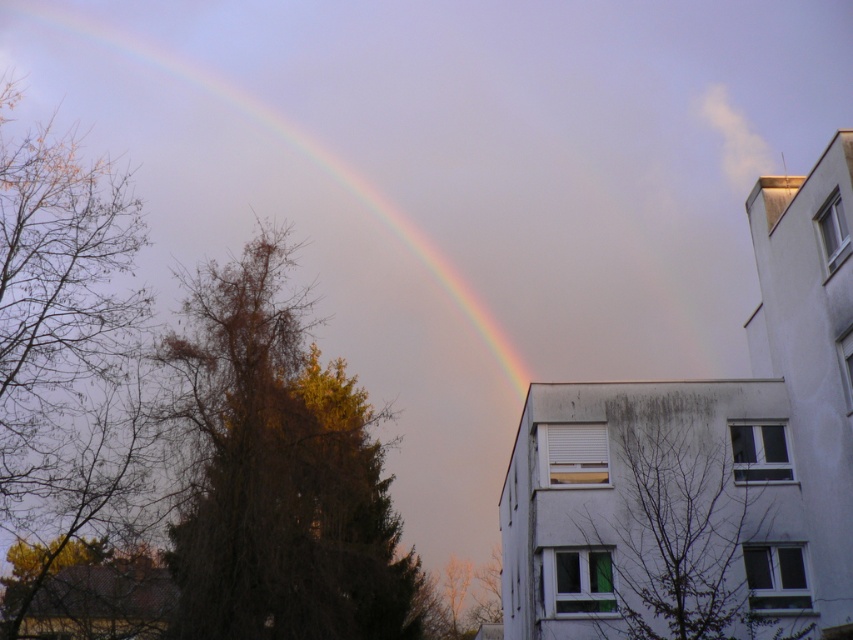
You are standing in the urban scene and want to take a photo of both the point at coordinates point (392, 176) and the point at coordinates point (55, 378). Which point will appear closer to the bottom of your camera viewfinder?

Point (55, 378) will appear closer to the bottom of the camera viewfinder because it is closer to the camera compared to point (392, 176), which is further away.

You are standing in the urban scene and want to take a photo of both the point at coordinates point (351, 547) and point (650, 456). To ensure both points are in focus, which point should you focus on first when adjusting your camera settings?

You should focus on point (650, 456) first because it is closer to the camera than point (351, 547). Since it is nearer, focusing on it first will help ensure the farther point remains in focus as well.